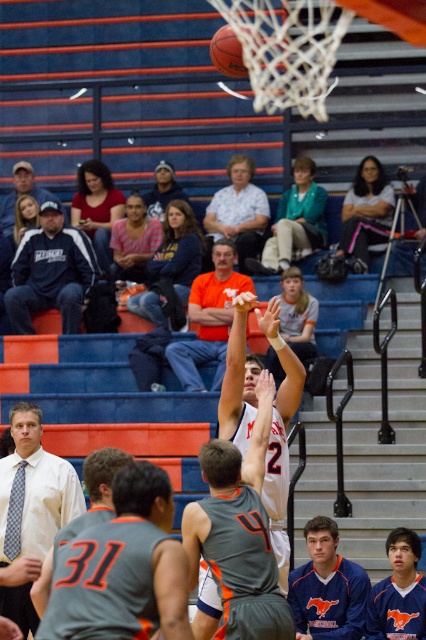
You are a referee in the gymnasium and need to determine if the two officials in the blue fleece jacket at center and orange jersey at center are within the required 5 meters for a conference. Can they hold their meeting without moving?

The distance between the blue fleece jacket at center and orange jersey at center is 5.59 meters, which exceeds the 5 meter requirement. Therefore, they need to move closer to hold their conference.

You are standing in the gymnasium and want to determine which of the two points, point (399, 582) or point (270, 227), is nearer to you. Based on the scene, which point is closer?

Point (399, 582) is closer to the camera than point (270, 227), so it is the nearer point.